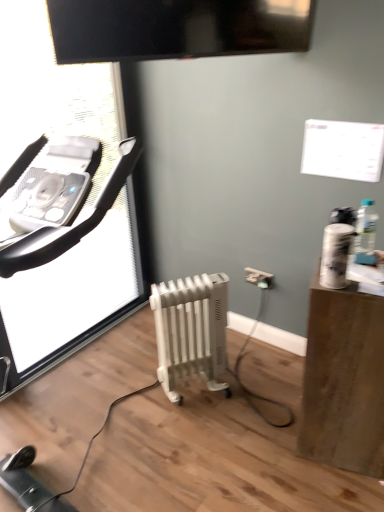
Question: Is the surface of brown wood side table at right in direct contact with transparent plastic screen door at left?

Choices:
 (A) yes
 (B) no

Answer: (B)

Question: Considering the relative positions of brown wood side table at right and transparent plastic screen door at left in the image provided, is brown wood side table at right in front of transparent plastic screen door at left?

Choices:
 (A) no
 (B) yes

Answer: (B)

Question: Considering the relative positions of brown wood side table at right and transparent plastic screen door at left in the image provided, is brown wood side table at right to the left of transparent plastic screen door at left from the viewer's perspective?

Choices:
 (A) no
 (B) yes

Answer: (A)

Question: From a real-world perspective, is brown wood side table at right located higher than transparent plastic screen door at left?

Choices:
 (A) no
 (B) yes

Answer: (A)

Question: Is brown wood side table at right bigger than transparent plastic screen door at left?

Choices:
 (A) no
 (B) yes

Answer: (A)

Question: Considering the relative sizes of brown wood side table at right and transparent plastic screen door at left in the image provided, is brown wood side table at right wider than transparent plastic screen door at left?

Choices:
 (A) yes
 (B) no

Answer: (A)

Question: Would you say clear plastic bottle at right is outside white plastic electric outlet at lower center?

Choices:
 (A) no
 (B) yes

Answer: (B)

Question: Is clear plastic bottle at right facing towards white plastic electric outlet at lower center?

Choices:
 (A) yes
 (B) no

Answer: (B)

Question: Can you confirm if clear plastic bottle at right is smaller than white plastic electric outlet at lower center?

Choices:
 (A) no
 (B) yes

Answer: (A)

Question: From a real-world perspective, is clear plastic bottle at right physically above white plastic electric outlet at lower center?

Choices:
 (A) no
 (B) yes

Answer: (B)

Question: From the image's perspective, is clear plastic bottle at right above white plastic electric outlet at lower center?

Choices:
 (A) yes
 (B) no

Answer: (A)

Question: Is clear plastic bottle at right taller than white plastic electric outlet at lower center?

Choices:
 (A) yes
 (B) no

Answer: (A)

Question: Considering the relative positions of transparent plastic screen door at left and brown wood side table at right in the image provided, is transparent plastic screen door at left behind brown wood side table at right?

Choices:
 (A) yes
 (B) no

Answer: (A)